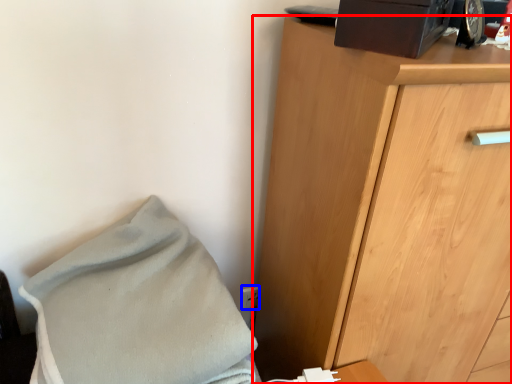
Question: Which object appears farthest to the camera in this image, chest of drawers (highlighted by a red box) or electric outlet (highlighted by a blue box)?

Choices:
 (A) chest of drawers
 (B) electric outlet

Answer: (B)